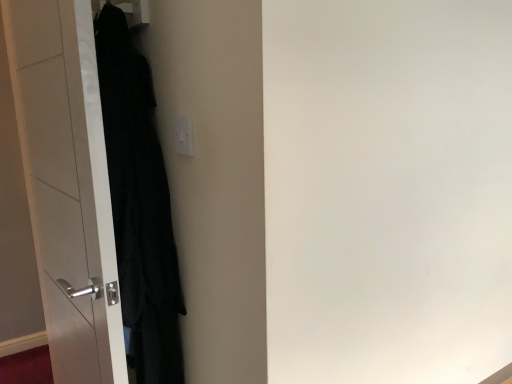
Question: Considering the relative positions of white glossy door at left and white plastic electric outlet at upper center in the image provided, is white glossy door at left to the left or to the right of white plastic electric outlet at upper center?

Choices:
 (A) left
 (B) right

Answer: (A)

Question: Considering the positions of white glossy door at left and white plastic electric outlet at upper center in the image, is white glossy door at left taller or shorter than white plastic electric outlet at upper center?

Choices:
 (A) tall
 (B) short

Answer: (A)

Question: Based on their relative distances, which object is nearer to the white glossy door at left?

Choices:
 (A) white plastic electric outlet at upper center
 (B) black matte coat at left

Answer: (B)

Question: Considering the real-world distances, which object is closest to the white glossy door at left?

Choices:
 (A) black matte coat at left
 (B) white plastic electric outlet at upper center

Answer: (A)